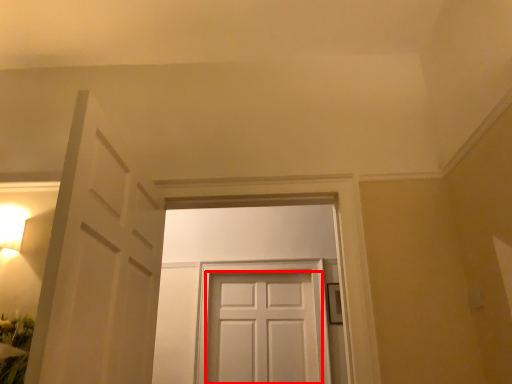
Question: From the image's perspective, what is the correct spatial relationship of door (annotated by the red box) in relation to door?

Choices:
 (A) above
 (B) below

Answer: (B)